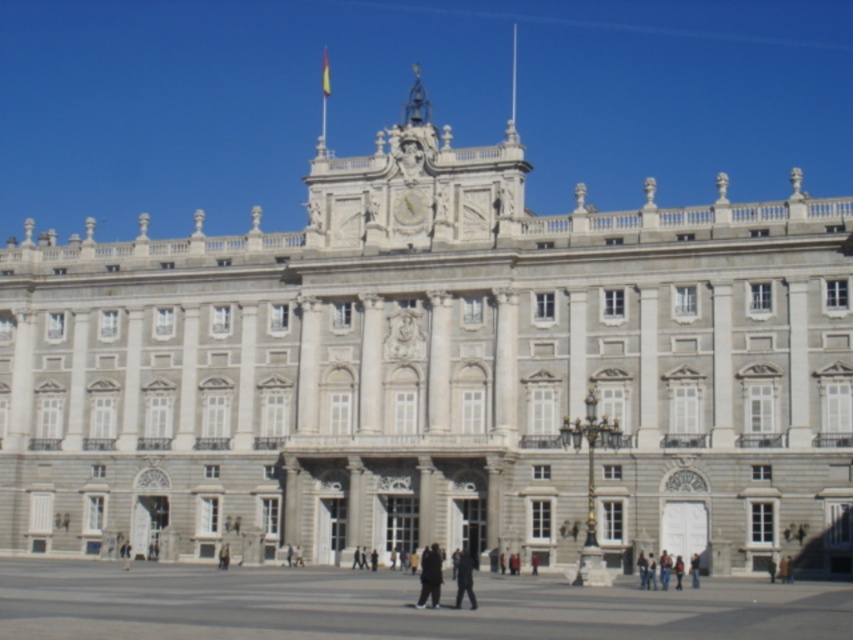
You are a GUI agent. You are given a task and a screenshot of the screen. Output one action in this format:
    pyautogui.click(x=<x>, y=<y>)
    Task: Click on the gray stone plaza at center
    The width and height of the screenshot is (853, 640).
    Given the screenshot: What is the action you would take?
    click(390, 605)

Does gray stone plaza at center have a smaller size compared to dark gray fabric pants at center?

Actually, gray stone plaza at center might be larger than dark gray fabric pants at center.

Does point (596, 620) come farther from viewer compared to point (434, 568)?

No, it is in front of (434, 568).

You are a GUI agent. You are given a task and a screenshot of the screen. Output one action in this format:
    pyautogui.click(x=<x>, y=<y>)
    Task: Click on the gray stone plaza at center
    This screenshot has height=640, width=853.
    Given the screenshot: What is the action you would take?
    pyautogui.click(x=390, y=605)

Does gray stone plaza at center have a lesser width compared to dark gray uniform at center?

No, gray stone plaza at center is not thinner than dark gray uniform at center.

Is gray stone plaza at center to the right of dark gray uniform at center from the viewer's perspective?

In fact, gray stone plaza at center is to the left of dark gray uniform at center.

Who is more distant from viewer, [527,616] or [457,586]?

The point [457,586] is more distant.

The height and width of the screenshot is (640, 853). In order to click on gray stone plaza at center in this screenshot , I will do `click(390, 605)`.

Does dark gray fabric pants at center appear under dark gray jacket at center?

No, dark gray fabric pants at center is not below dark gray jacket at center.

Does dark gray fabric pants at center have a smaller size compared to dark gray jacket at center?

Actually, dark gray fabric pants at center might be larger than dark gray jacket at center.

Is point (422, 556) in front of point (221, 563)?

That is True.

Find the location of a particular element. This screenshot has height=640, width=853. dark gray fabric pants at center is located at coordinates (428, 576).